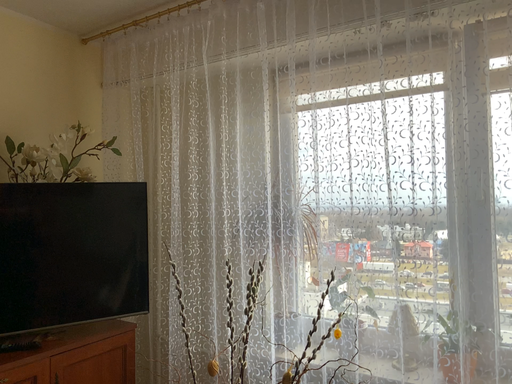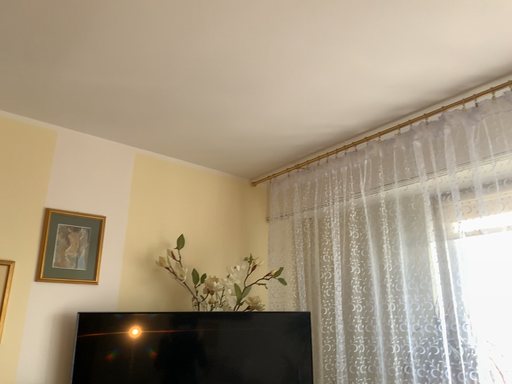
Question: How did the camera likely rotate when shooting the video?

Choices:
 (A) rotated downward
 (B) rotated upward

Answer: (B)